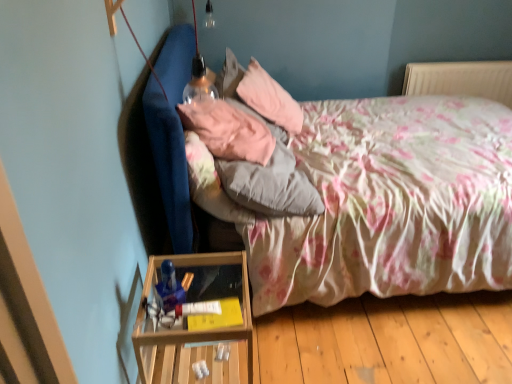
Question: Considering their positions, is pink fabric pillow at upper center, the second pillow when ordered from back to front, located in front of or behind floral fabric bed at center?

Choices:
 (A) front
 (B) behind

Answer: (B)

Question: Is point (230, 120) positioned closer to the camera than point (480, 107)?

Choices:
 (A) farther
 (B) closer

Answer: (B)

Question: Estimate the real-world distances between objects in this image. Which object is closer to the floral fabric bed at center?

Choices:
 (A) pink fabric pillow at upper center, acting as the 1th pillow starting from the front
 (B) velvet pink pillow at upper center, the 2th pillow from the front

Answer: (A)

Question: Estimate the real-world distances between objects in this image. Which object is farther from the pink fabric pillow at upper center, the second pillow when ordered from back to front?

Choices:
 (A) floral fabric bed at center
 (B) velvet pink pillow at upper center, the 2th pillow from the front

Answer: (A)